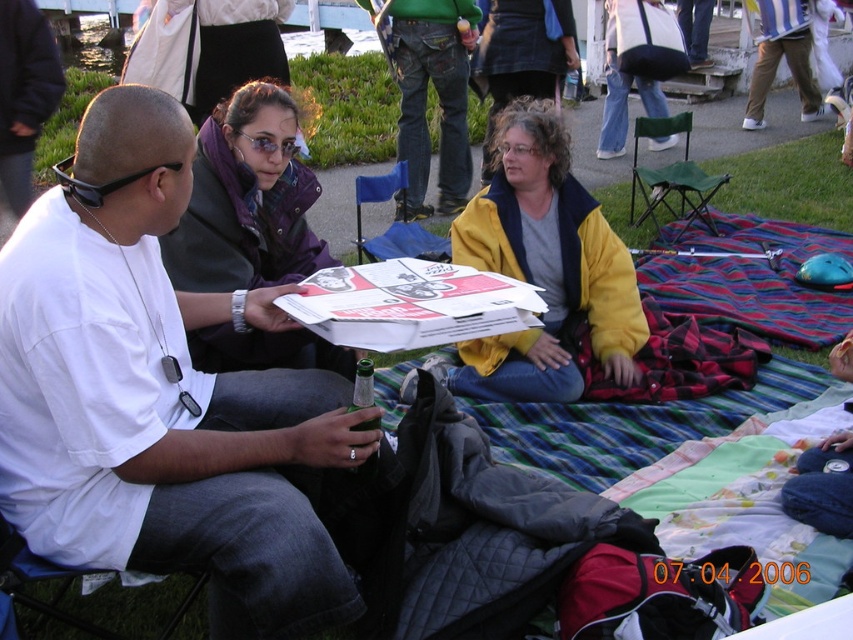
You are a photographer at the picnic and want to take a picture of both the white matte shirt at center and the yellow fleece jacket at center. Which one should you focus on first if you want to capture them both clearly in the same frame?

The white matte shirt at center is positioned on the left side of yellow fleece jacket at center, so you should focus on the white matte shirt at center first to ensure both are in the frame.

You are planning to place a small cooler at point (544, 266) where the yellow fleece jacket is currently located. Is there enough space to place the cooler there?

At point (544, 266) lies the yellow fleece jacket at center, so no, there is not enough space to place the cooler there as the jacket is already occupying that spot.

You are a photographer trying to capture a closeup of the two points in the image. Which point, point [53,236] or point [253,125], is closer to your camera?

Point [53,236] is closer to the camera than point [253,125].